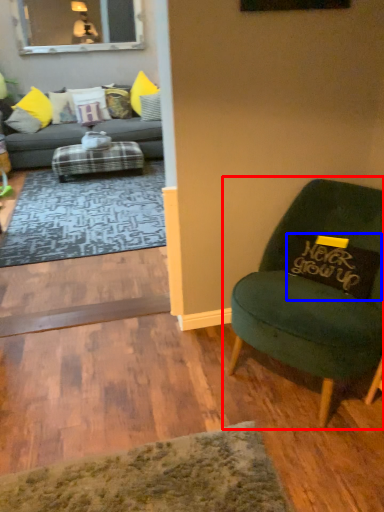
Question: Which object is closer to the camera taking this photo, chair (highlighted by a red box) or pillow (highlighted by a blue box)?

Choices:
 (A) chair
 (B) pillow

Answer: (A)